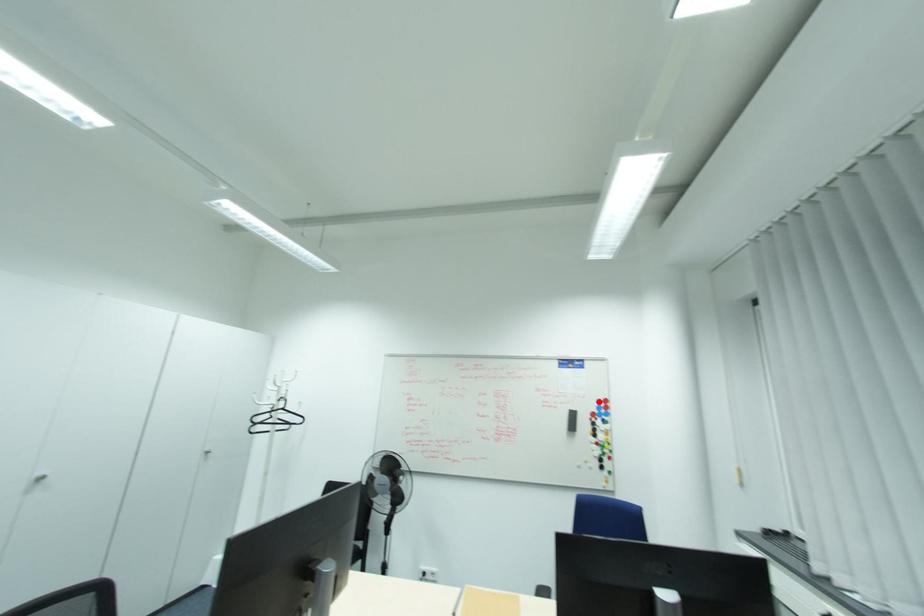
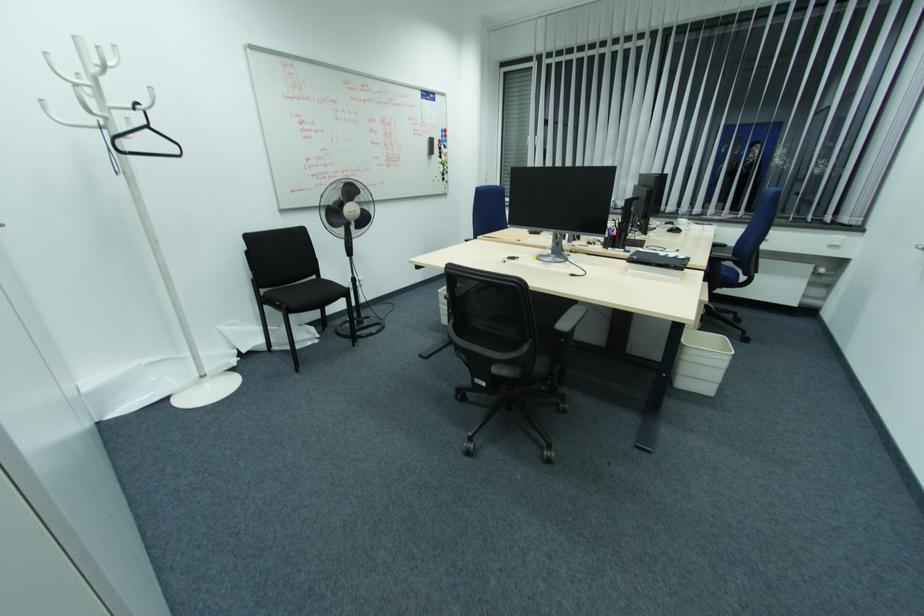
Question: I am providing you with two images of the same scene from different viewpoints. Image1 has a red point marked. In image2, the corresponding 3D location appears at what relative position? Reply with the corresponding letter.

Choices:
 (A) Closer
 (B) Farther

Answer: (A)